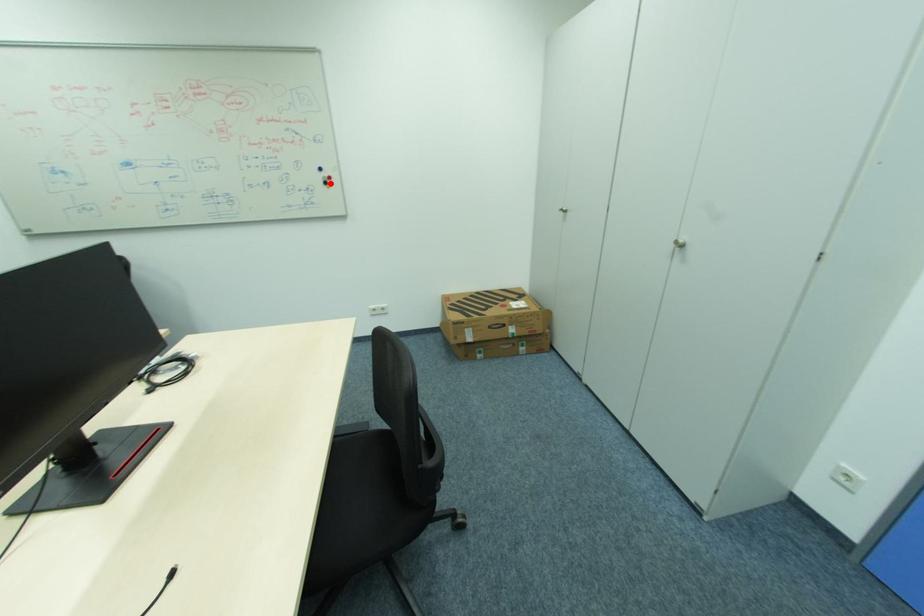
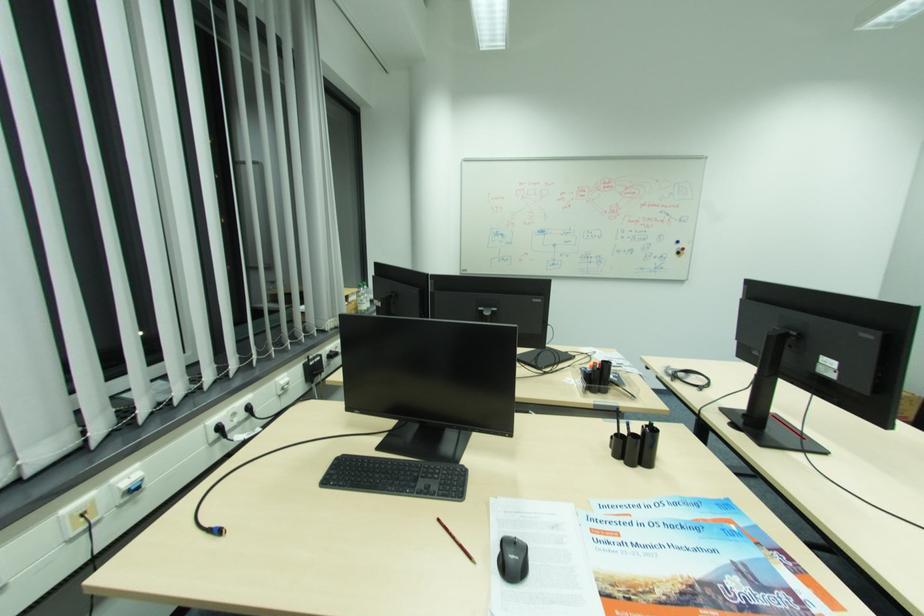
Question: I am providing you with two images of the same scene from different viewpoints. In image1, a red point is highlighted. Considering the same 3D point in image2, which of the following is correct?

Choices:
 (A) It is closer
 (B) It is farther

Answer: (B)